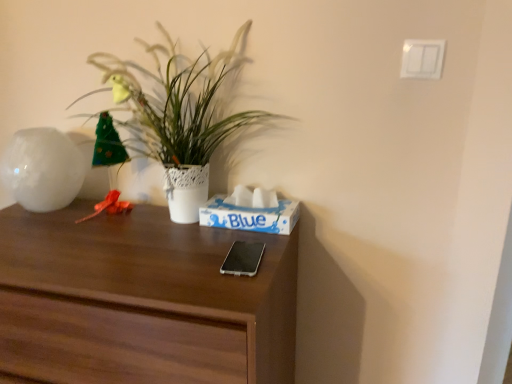
I want to click on free space in front of blue paper tissue box at center, so click(230, 249).